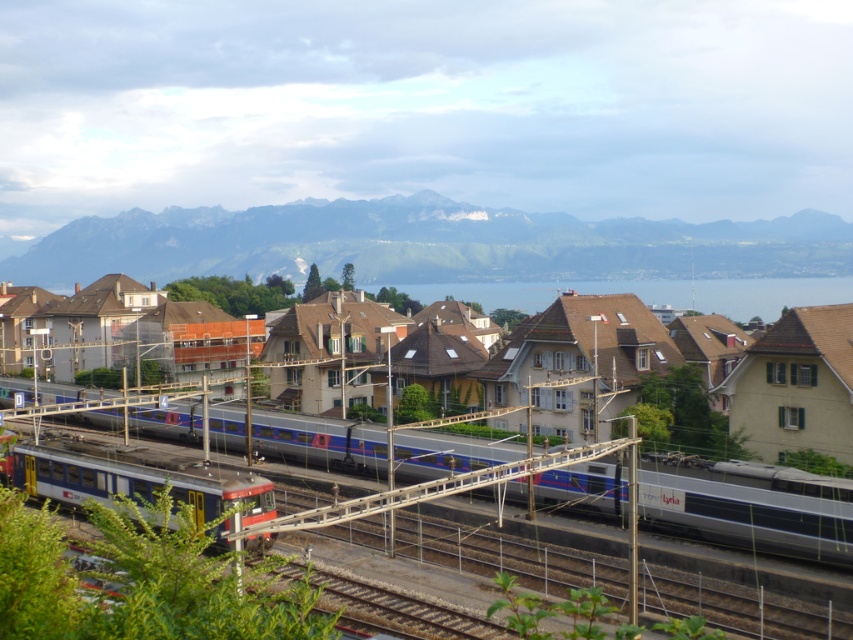
Does snowy rocky mountain at upper center appear over blue water at center?

Correct, snowy rocky mountain at upper center is located above blue water at center.

Is point (421, 257) closer to camera compared to point (651, 291)?

Yes, point (421, 257) is in front of point (651, 291).

Image resolution: width=853 pixels, height=640 pixels. In order to click on snowy rocky mountain at upper center in this screenshot , I will do `click(427, 244)`.

What do you see at coordinates (427, 244) in the screenshot? I see `snowy rocky mountain at upper center` at bounding box center [427, 244].

Is snowy rocky mountain at upper center to the right of silver metallic train at center from the viewer's perspective?

Correct, you'll find snowy rocky mountain at upper center to the right of silver metallic train at center.

Who is more distant from viewer, (x=778, y=225) or (x=291, y=419)?

The point (x=778, y=225) is behind.

In order to click on snowy rocky mountain at upper center in this screenshot , I will do `click(427, 244)`.

Based on the photo, between blue metallic train at lower left and blue water at center, which one appears on the left side from the viewer's perspective?

Positioned to the left is blue metallic train at lower left.

Where is `blue metallic train at lower left`? This screenshot has height=640, width=853. blue metallic train at lower left is located at coordinates (137, 480).

Is point (177, 490) farther from camera compared to point (740, 316)?

No, (177, 490) is closer to viewer.

Where is `blue metallic train at lower left`? blue metallic train at lower left is located at coordinates (137, 480).